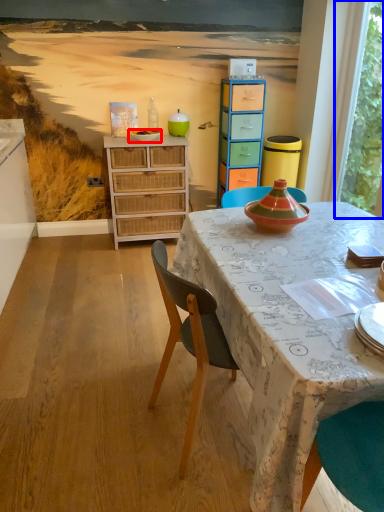
Question: Which point is further to the camera, bowl (highlighted by a red box) or window screen (highlighted by a blue box)?

Choices:
 (A) bowl
 (B) window screen

Answer: (A)